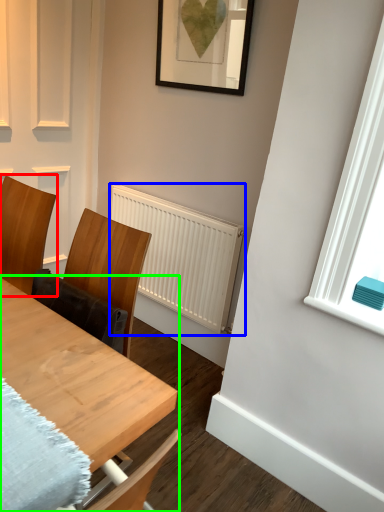
Question: Which object is the closest to the chair (highlighted by a red box)? Choose among these: radiator (highlighted by a blue box) or table (highlighted by a green box).

Choices:
 (A) radiator
 (B) table

Answer: (B)